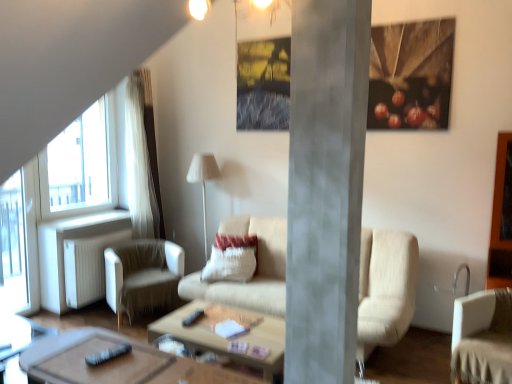
Question: Considering the positions of white textured pillow at center and white fabric lamp at center in the image, is white textured pillow at center bigger or smaller than white fabric lamp at center?

Choices:
 (A) big
 (B) small

Answer: (B)

Question: Relative to white fabric lamp at center, is white textured pillow at center in front or behind?

Choices:
 (A) front
 (B) behind

Answer: (A)

Question: Considering the real-world distances, which object is closest to the wooden polished coffee table at center, which appears as the second coffee table when viewed from the back?

Choices:
 (A) white fabric lamp at center
 (B) transparent glass window at left
 (C) wooden side table at lower left
 (D) beige fabric couch at center
 (E) concrete pillar at center

Answer: (C)

Question: Which is farther from the transparent glass window at left?

Choices:
 (A) matte white light fixture at upper center
 (B) wooden side table at lower left
 (C) transparent glass window at left
 (D) white fabric chair at left, placed as the 2th chair when sorted from right to left
 (E) white fabric chair at lower right, the first chair in the front-to-back sequence

Answer: (E)